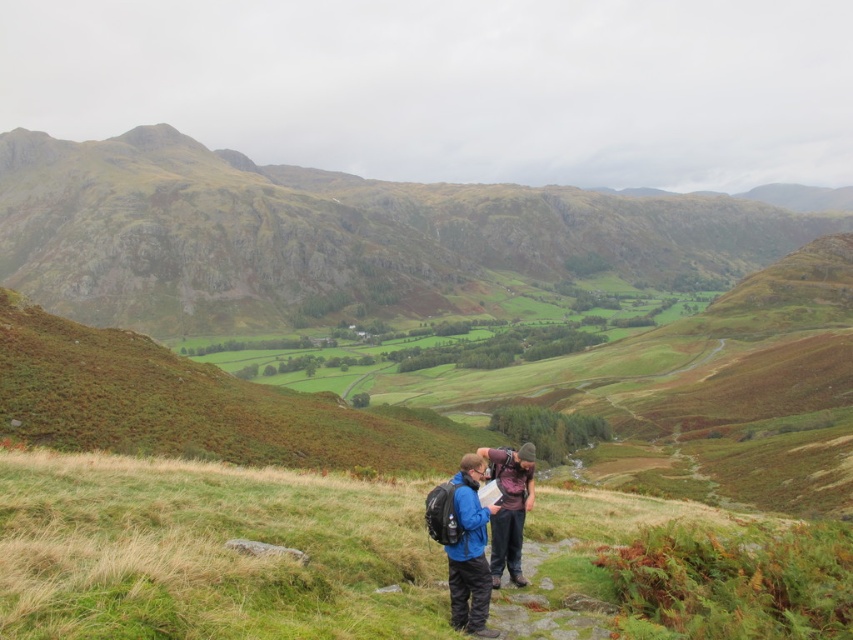
From the picture: You are a hiker trying to navigate between two points marked on your map. The first point is labeled as point (451, 212) and the second as point (514, 512). Which point is closer to your current position if you are standing at the camera position?

Point (451, 212) is further to the camera than point (514, 512), so the point closer to your current position is point (514, 512).

You are a hiker trying to navigate the rugged stone mountain at center and the blue fabric backpack at center. According to the map you have, which object is located to the right of the other?

The rugged stone mountain at center is positioned on the right side of blue fabric backpack at center, so the rugged stone mountain at center is to the right of the blue fabric backpack at center.

Looking at this image, you are a hiker trying to determine your position based on the map. You notice the green grassy at center and the matte purple shirt at center. Which object is located lower in the scene?

The green grassy at center is positioned under matte purple shirt at center, so the green grassy at center is lower in the scene.